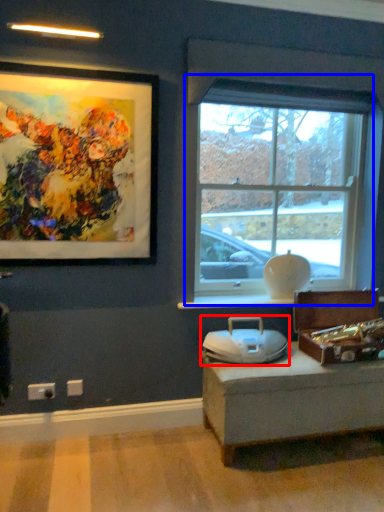
Question: Which of the following is the closest to the observer, swivel chair (highlighted by a red box) or window (highlighted by a blue box)?

Choices:
 (A) swivel chair
 (B) window

Answer: (A)